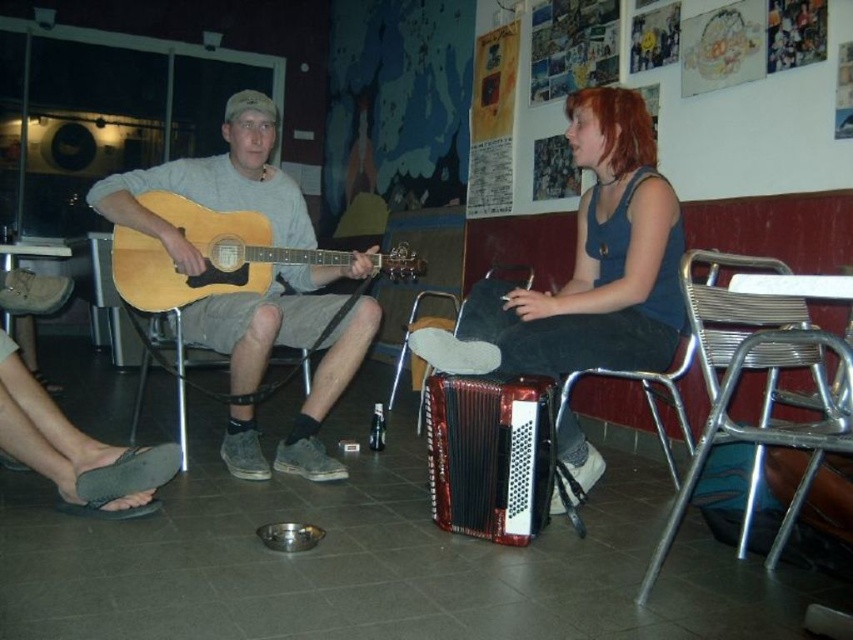
You are a photographer standing in front of the scene. You want to take a closeup of the matte wood guitar at left without the metallic silver chair at left blocking the view. Is it possible?

The matte wood guitar at left is further to the viewer than the metallic silver chair at left, so taking a closeup of the matte wood guitar at left without the metallic silver chair at left blocking the view is possible because the guitar is closer to you and the chair is behind it.